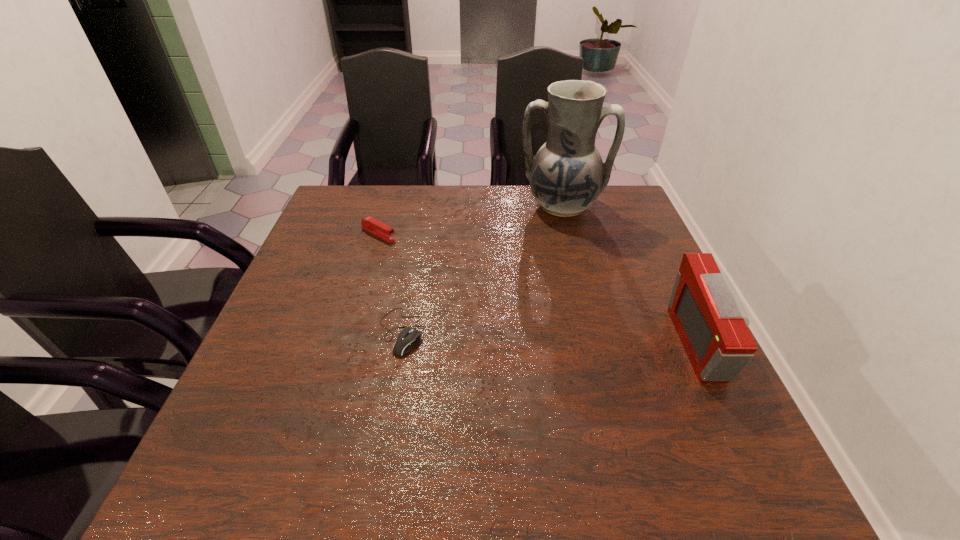
Identify the location of free space between the shortest object and the second shortest object. (390, 283).

The width and height of the screenshot is (960, 540). What are the coordinates of `unoccupied position between the third object from left to right and the computer mouse` in the screenshot? It's located at (481, 269).

The height and width of the screenshot is (540, 960). In order to click on empty space that is in between the leftmost object and the second object from right to left in this screenshot , I will do `click(470, 221)`.

Identify the location of vacant space that's between the second tallest object and the leftmost object. (540, 289).

Find the location of `vacant region between the shortest object and the second shortest object`. vacant region between the shortest object and the second shortest object is located at coordinates (390, 283).

Locate an element on the screen. The height and width of the screenshot is (540, 960). free space between the leftmost object and the second object from left to right is located at coordinates (390, 283).

The height and width of the screenshot is (540, 960). I want to click on empty location between the rightmost object and the leftmost object, so click(x=540, y=289).

Select which object is the closest to the third object from left to right. Please provide its 2D coordinates. Your answer should be formatted as a tuple, i.e. [(x, y)], where the tuple contains the x and y coordinates of a point satisfying the conditions above.

[(710, 320)]

At what (x,y) coordinates should I click in order to perform the action: click on the second closest object to the computer mouse. Please return your answer as a coordinate pair (x, y). The image size is (960, 540). Looking at the image, I should click on coord(567,175).

Locate an element on the screen. vacant space that satisfies the following two spatial constraints: 1. on the back side of the shortest object; 2. on the left side of the tallest object is located at coordinates (423, 207).